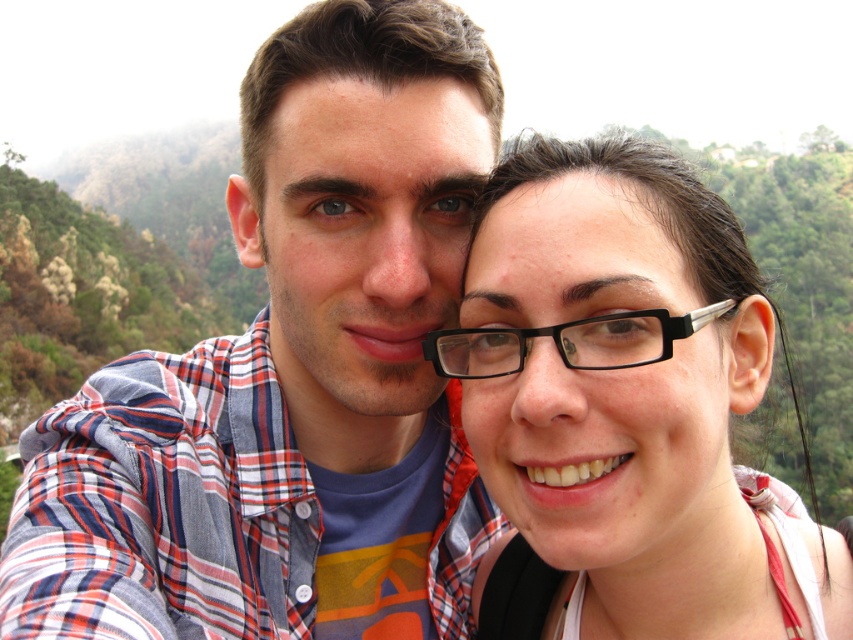
Question: Which point is farther from the camera taking this photo?

Choices:
 (A) (90, 515)
 (B) (544, 520)

Answer: (B)

Question: Does plaid shirt at center appear over clear plastic glasses at upper right?

Choices:
 (A) no
 (B) yes

Answer: (B)

Question: In this image, where is plaid shirt at center located relative to black plastic glasses at center?

Choices:
 (A) left
 (B) right

Answer: (A)

Question: Is plaid shirt at center further to the viewer compared to clear plastic glasses at upper right?

Choices:
 (A) yes
 (B) no

Answer: (B)

Question: Which of the following is the closest to the observer?

Choices:
 (A) (637, 326)
 (B) (126, 509)

Answer: (B)

Question: Which of the following is the closest to the observer?

Choices:
 (A) (836, 611)
 (B) (79, 438)

Answer: (B)